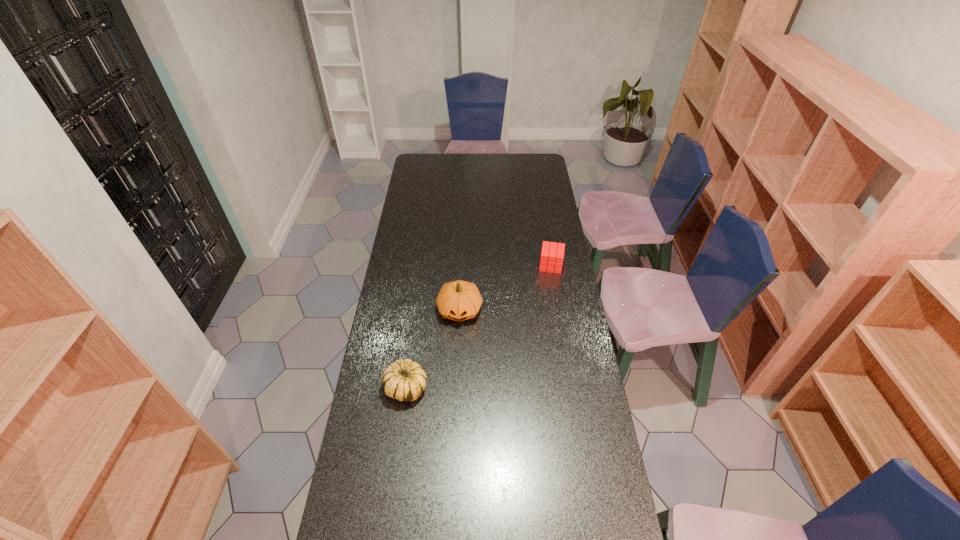
You are a GUI agent. You are given a task and a screenshot of the screen. Output one action in this format:
    pyautogui.click(x=<x>, y=<y>)
    Task: Click on the blank region between the rightmost object and the second nearest object
    Image resolution: width=960 pixels, height=540 pixels.
    Given the screenshot: What is the action you would take?
    pyautogui.click(x=505, y=288)

Identify the location of object that is the second closest to the farthest object. pos(405,380).

Select which object is the second closest to the rightmost object. Please provide its 2D coordinates. Your answer should be formatted as a tuple, i.e. [(x, y)], where the tuple contains the x and y coordinates of a point satisfying the conditions above.

[(405, 380)]

Find the location of a particular element. free location that satisfies the following two spatial constraints: 1. on the back side of the second shortest object; 2. on the right side of the shortest object is located at coordinates (422, 266).

Find the location of a particular element. The height and width of the screenshot is (540, 960). vacant space that satisfies the following two spatial constraints: 1. on the back side of the leftmost object; 2. on the right side of the rightmost object is located at coordinates (422, 266).